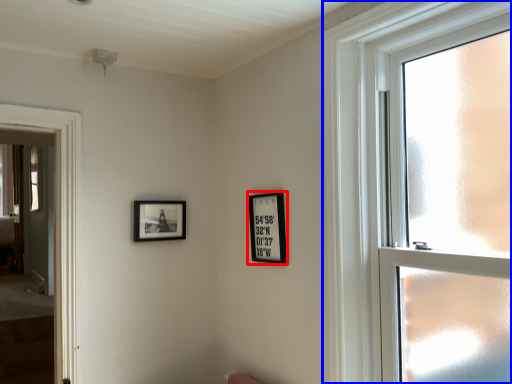
Question: Which object is closer to the camera taking this photo, picture frame (highlighted by a red box) or window (highlighted by a blue box)?

Choices:
 (A) picture frame
 (B) window

Answer: (B)